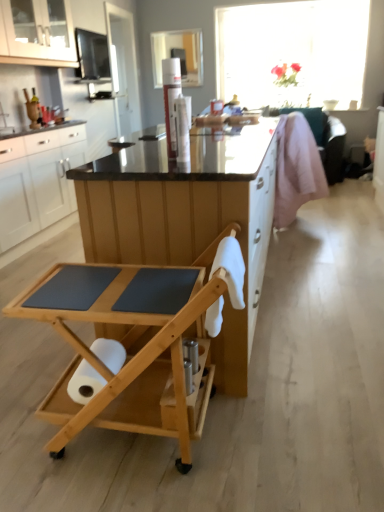
Question: Considering the relative positions of pink fabric swivel chair at right and white glossy cabinet at upper left, which is the 2th cabinetry from bottom to top, in the image provided, is pink fabric swivel chair at right in front of white glossy cabinet at upper left, which is the 2th cabinetry from bottom to top,?

Choices:
 (A) no
 (B) yes

Answer: (A)

Question: Is pink fabric swivel chair at right behind white glossy cabinet at upper left, placed as the 1th cabinetry when sorted from top to bottom?

Choices:
 (A) yes
 (B) no

Answer: (A)

Question: Is pink fabric swivel chair at right aimed at white glossy cabinet at upper left, placed as the 1th cabinetry when sorted from top to bottom?

Choices:
 (A) no
 (B) yes

Answer: (B)

Question: From a real-world perspective, does pink fabric swivel chair at right sit lower than white glossy cabinet at upper left, which is the 2th cabinetry from bottom to top?

Choices:
 (A) yes
 (B) no

Answer: (A)

Question: From a real-world perspective, is pink fabric swivel chair at right positioned over white glossy cabinet at upper left, which is the 2th cabinetry from bottom to top, based on gravity?

Choices:
 (A) yes
 (B) no

Answer: (B)

Question: Could white glossy cabinet at upper left, placed as the 1th cabinetry when sorted from top to bottom, be considered to be inside pink fabric swivel chair at right?

Choices:
 (A) yes
 (B) no

Answer: (B)

Question: Is natural wood rolling cart at center behind white matte toilet paper at lower left?

Choices:
 (A) no
 (B) yes

Answer: (A)

Question: Is natural wood rolling cart at center far away from white matte toilet paper at lower left?

Choices:
 (A) no
 (B) yes

Answer: (A)

Question: Is white matte toilet paper at lower left completely or partially inside natural wood rolling cart at center?

Choices:
 (A) no
 (B) yes

Answer: (B)

Question: Can you confirm if natural wood rolling cart at center is thinner than white matte toilet paper at lower left?

Choices:
 (A) no
 (B) yes

Answer: (A)

Question: Does natural wood rolling cart at center have a greater height compared to white matte toilet paper at lower left?

Choices:
 (A) yes
 (B) no

Answer: (A)

Question: From the image's perspective, is natural wood rolling cart at center above white matte toilet paper at lower left?

Choices:
 (A) yes
 (B) no

Answer: (A)

Question: Is white matte cabinet at left, which appears as the 2th cabinetry when viewed from the top, located outside white glossy cabinet at upper left, placed as the 1th cabinetry when sorted from top to bottom?

Choices:
 (A) yes
 (B) no

Answer: (A)